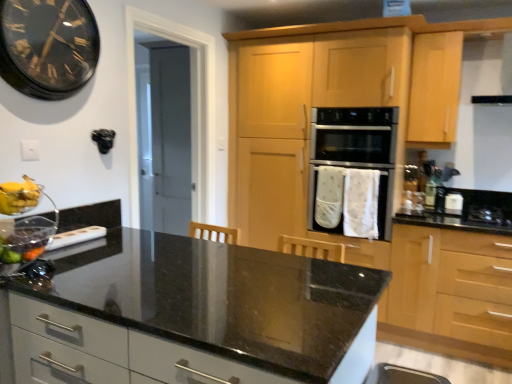
Question: From the image's perspective, is light wood/texture cabinet at right, the 2th cabinetry in the left-to-right sequence, beneath black glass clock at upper left?

Choices:
 (A) no
 (B) yes

Answer: (B)

Question: Is light wood/texture cabinet at right, the 2th cabinetry in the left-to-right sequence, outside of black glass clock at upper left?

Choices:
 (A) yes
 (B) no

Answer: (A)

Question: Is light wood/texture cabinet at right, arranged as the 1th cabinetry when viewed from the right, at the right side of black glass clock at upper left?

Choices:
 (A) no
 (B) yes

Answer: (B)

Question: Is light wood/texture cabinet at right, arranged as the 1th cabinetry when viewed from the right, next to black glass clock at upper left and touching it?

Choices:
 (A) yes
 (B) no

Answer: (B)

Question: Would you say black glass clock at upper left is part of light wood/texture cabinet at right, arranged as the 1th cabinetry when viewed from the right,'s contents?

Choices:
 (A) yes
 (B) no

Answer: (B)

Question: Is black matte exhaust hood at upper right taller or shorter than light wood cabinetry at center, the 1th cabinetry when ordered from left to right?

Choices:
 (A) tall
 (B) short

Answer: (B)

Question: In terms of size, does black matte exhaust hood at upper right appear bigger or smaller than light wood cabinetry at center, the 2th cabinetry from the right?

Choices:
 (A) small
 (B) big

Answer: (A)

Question: Is point (475, 62) closer or farther from the camera than point (302, 72)?

Choices:
 (A) farther
 (B) closer

Answer: (A)

Question: Considering the positions of black matte exhaust hood at upper right and light wood cabinetry at center, the 1th cabinetry when ordered from left to right, in the image, is black matte exhaust hood at upper right wider or thinner than light wood cabinetry at center, the 1th cabinetry when ordered from left to right,?

Choices:
 (A) wide
 (B) thin

Answer: (B)

Question: Relative to black glass clock at upper left, is black granite countertop at center in front or behind?

Choices:
 (A) front
 (B) behind

Answer: (A)

Question: From a real-world perspective, is black granite countertop at center positioned above or below black glass clock at upper left?

Choices:
 (A) above
 (B) below

Answer: (B)

Question: Considering the positions of black granite countertop at center and black glass clock at upper left in the image, is black granite countertop at center taller or shorter than black glass clock at upper left?

Choices:
 (A) short
 (B) tall

Answer: (B)

Question: Is point (167, 352) closer or farther from the camera than point (75, 21)?

Choices:
 (A) closer
 (B) farther

Answer: (A)

Question: Is transparent glass bowl at lower left wider or thinner than white fabric oven at center?

Choices:
 (A) thin
 (B) wide

Answer: (A)

Question: In the image, is transparent glass bowl at lower left positioned in front of or behind white fabric oven at center?

Choices:
 (A) behind
 (B) front

Answer: (B)